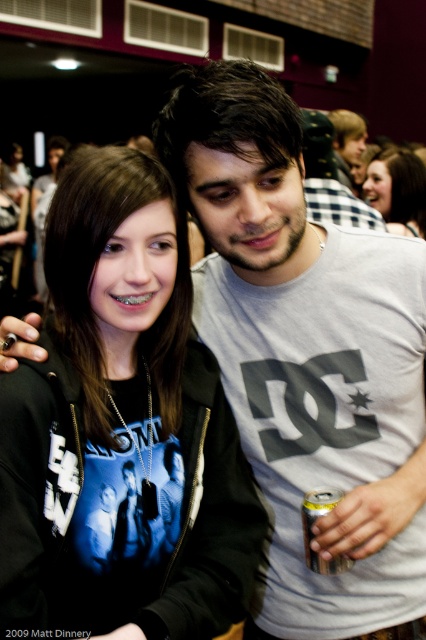
Which of these two, black matte hoodie at center or gray cotton t-shirt at upper right, stands shorter?

Standing shorter between the two is gray cotton t-shirt at upper right.

Is black matte hoodie at center further to camera compared to gray cotton t-shirt at upper right?

No, black matte hoodie at center is closer to the viewer.

You are a GUI agent. You are given a task and a screenshot of the screen. Output one action in this format:
    pyautogui.click(x=<x>, y=<y>)
    Task: Click on the black matte hoodie at center
    The height and width of the screenshot is (640, 426).
    Given the screenshot: What is the action you would take?
    pyautogui.click(x=121, y=429)

Measure the distance from matte black hoodie at upper right to silver metallic can at lower center.

matte black hoodie at upper right and silver metallic can at lower center are 8.33 feet apart from each other.

Measure the distance between point (391, 195) and camera.

Point (391, 195) and camera are 3.21 meters apart from each other.

Locate an element on the screen. The width and height of the screenshot is (426, 640). matte black hoodie at upper right is located at coordinates (397, 189).

Does gray cotton t-shirt at upper right have a smaller size compared to silver metallic can at lower center?

Incorrect, gray cotton t-shirt at upper right is not smaller in size than silver metallic can at lower center.

How far apart are gray cotton t-shirt at upper right and silver metallic can at lower center?

gray cotton t-shirt at upper right is 3.66 meters away from silver metallic can at lower center.

At what (x,y) coordinates should I click in order to perform the action: click on gray cotton t-shirt at upper right. Please return your answer as a coordinate pair (x, y). This screenshot has height=640, width=426. Looking at the image, I should click on (348, 144).